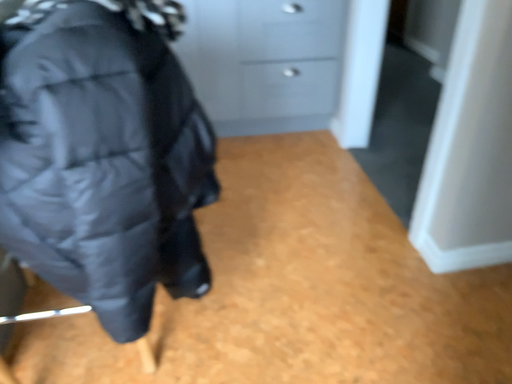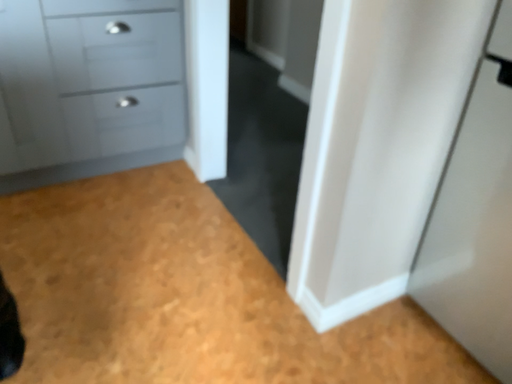
Question: Which way did the camera rotate in the video?

Choices:
 (A) rotated left
 (B) rotated right

Answer: (B)